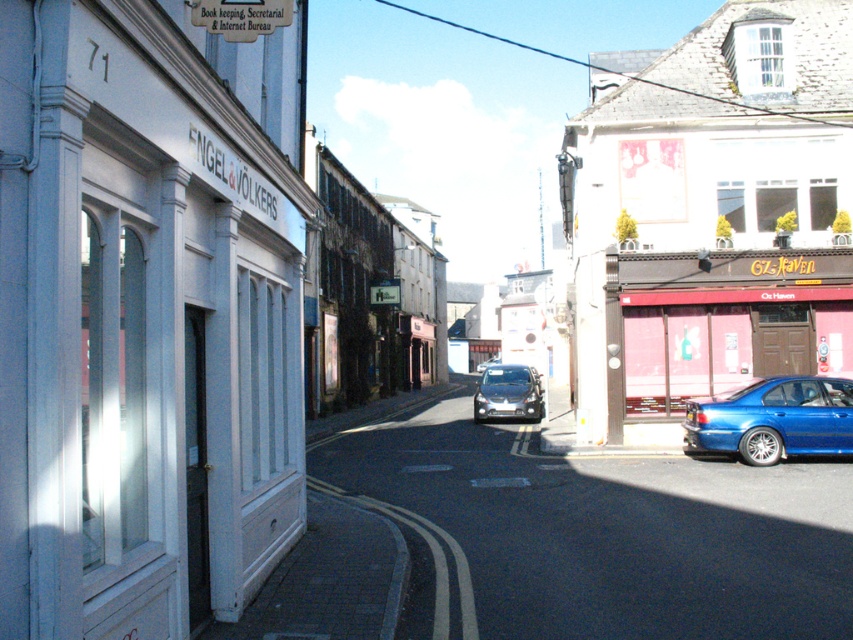
You are a delivery person trying to park your motorcycle between the pink matte door at right and the glossy blue sedan at lower right. Can you fit your motorcycle there if the motorcycle is 1.2 meters wide?

The pink matte door at right might be wider than the glossy blue sedan at lower right, but the exact width isn not provided. Without knowing the actual width of the space between them, it is uncertain if the motorcycle will fit.

You are driving a car and want to park in the street. You see a glossy blue sedan at lower right and a shiny silver car at center. Which car is closer to the curb on the right side of the street?

The glossy blue sedan at lower right is to the right of the shiny silver car at center, so it is closer to the curb on the right side of the street.

You are a delivery person trying to find the entrance to the real estate agency, Engel and V?lkers, located on the left side of the street. You see a pink matte door at right and a shiny silver car at center. Which object is closer to the entrance of the real estate agency?

The pink matte door at right is farther away from the entrance of the real estate agency Engel and V?lkers, which is on the left side of the street. The shiny silver car at center is closer to the entrance than the pink matte door at right because it is positioned between them.